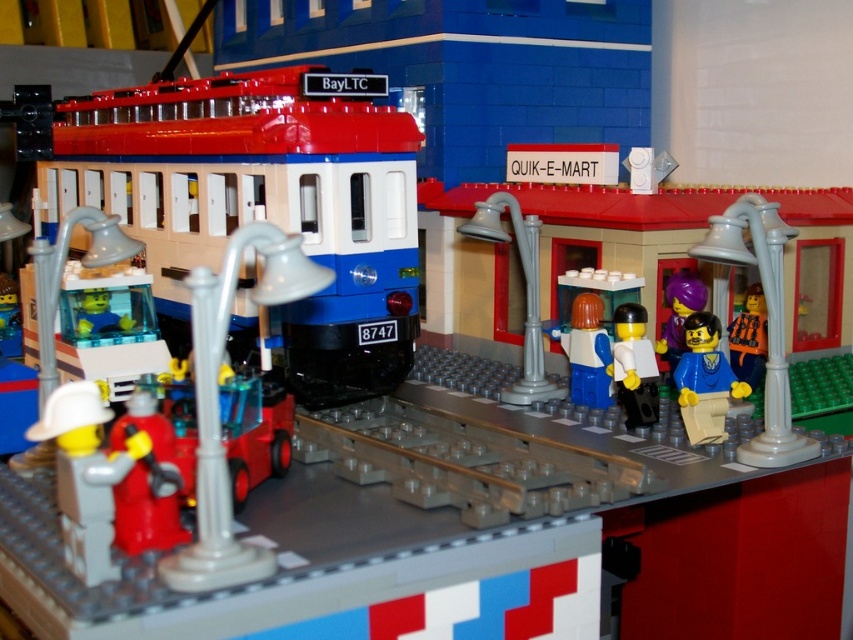
You are a photographer standing in front of the LEGO diorama. You want to take a photo that includes both the point at coordinates point (x=450, y=417) and point (x=108, y=413). Which point is closer to the camera?

Point (x=108, y=413) is closer to the camera than point (x=450, y=417) because the description states that point (x=450, y=417) is further away.